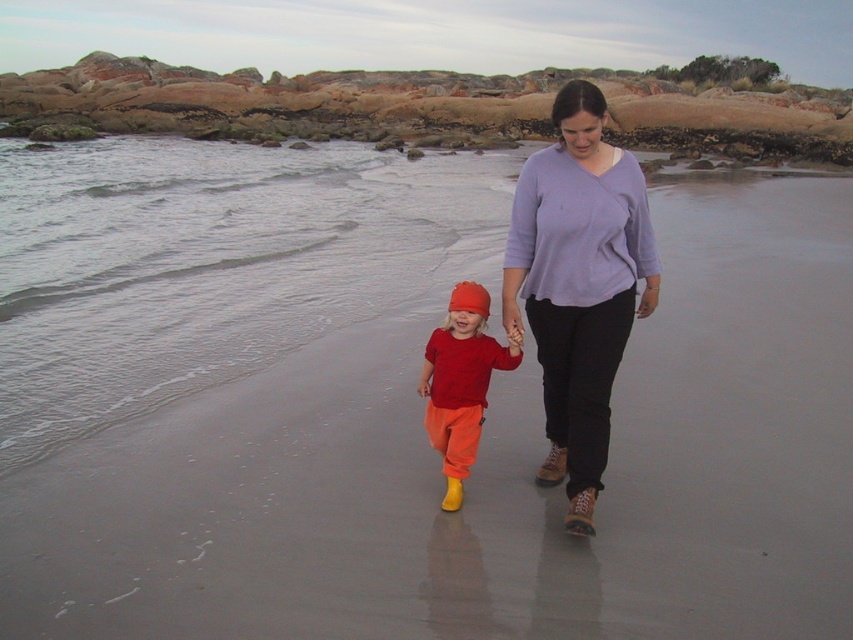
You are a photographer trying to capture a photo of the two people on the beach. You need to ensure that both the matte purple sweater at center and the matte orange pants at center are clearly visible in the frame. Based on their heights, which object should you focus on first to ensure both are in focus?

The matte purple sweater at center is shorter than the matte orange pants at center. To ensure both are in focus, you should focus on the taller object first, which is the matte orange pants at center, as focusing on the taller object will help capture the shorter one within the same focal plane.